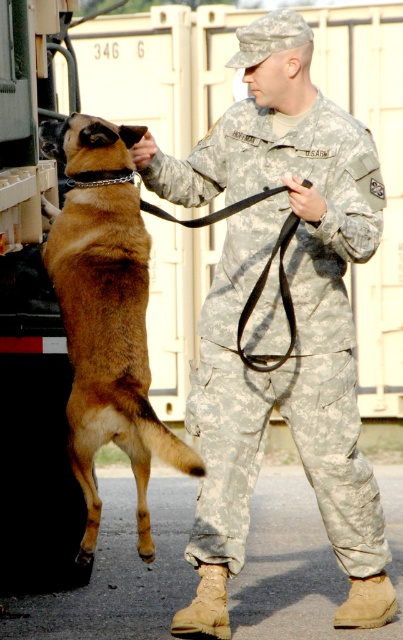
You are a photographer trying to capture a photo of the camouflage fabric uniform at center and the brown fur dog at center. Since you want the dog to look bigger in the photo, where should you position the camera relative to them?

To make the brown fur dog at center appear larger in the photo, position the camera closer to the brown fur dog at center than the camouflage fabric uniform at center, since the camouflage fabric uniform at center is taller than the brown fur dog at center.

You are a drone operator trying to locate two specific points in a military training area. The points are labeled as point (299,296) and point (130,189). Based on the scene description, which point is closer to your drone camera?

Point (130,189) is closer to the drone camera because the Objects Description states that point (299,296) is further to the camera than point (130,189).

You are a military analyst reviewing this image. You need to determine the exact location of the point marked at coordinates (297, 324). Based on the scene, which object does this point lie on?

The point at coordinates (297, 324) is located on the camouflage fabric uniform at center.